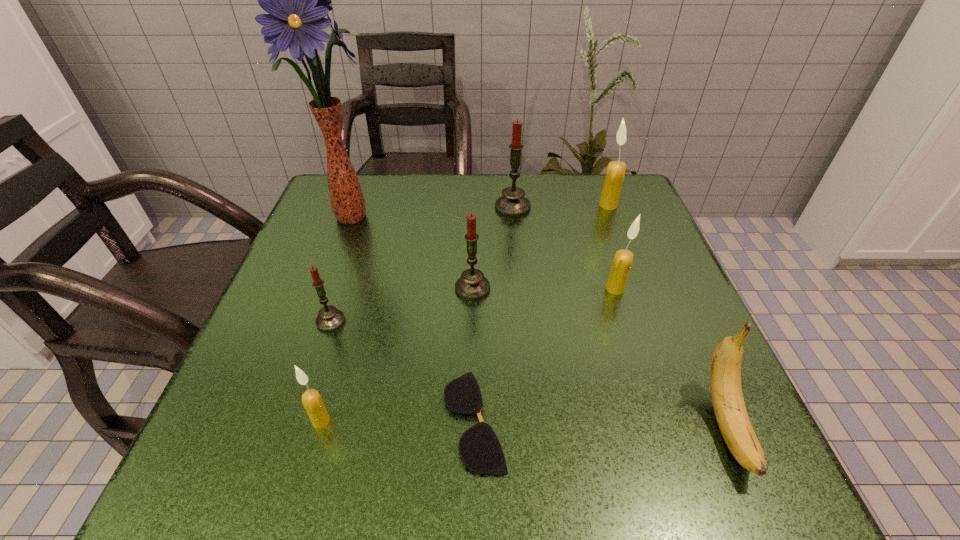
Locate an element on the screen. The image size is (960, 540). the tallest object is located at coordinates (297, 0).

What are the coordinates of `purple flower arrangement` in the screenshot? It's located at (297, 0).

I want to click on the farthest red candle, so click(x=513, y=204).

You are a GUI agent. You are given a task and a screenshot of the screen. Output one action in this format:
    pyautogui.click(x=<x>, y=<y>)
    Task: Click on the biggest red candle
    This screenshot has width=960, height=540.
    Given the screenshot: What is the action you would take?
    pyautogui.click(x=513, y=204)

This screenshot has height=540, width=960. I want to click on the farthest cream candle, so click(x=615, y=173).

This screenshot has height=540, width=960. I want to click on the second object from right to left, so click(x=615, y=173).

Image resolution: width=960 pixels, height=540 pixels. I want to click on the second red candle from left to right, so click(472, 285).

You are a GUI agent. You are given a task and a screenshot of the screen. Output one action in this format:
    pyautogui.click(x=<x>, y=<y>)
    Task: Click on the fourth candle from right to left
    
    Given the screenshot: What is the action you would take?
    pyautogui.click(x=472, y=285)

Identify the location of the second cream candle from right to left. (623, 259).

This screenshot has height=540, width=960. Identify the location of the second biggest cream candle. (623, 259).